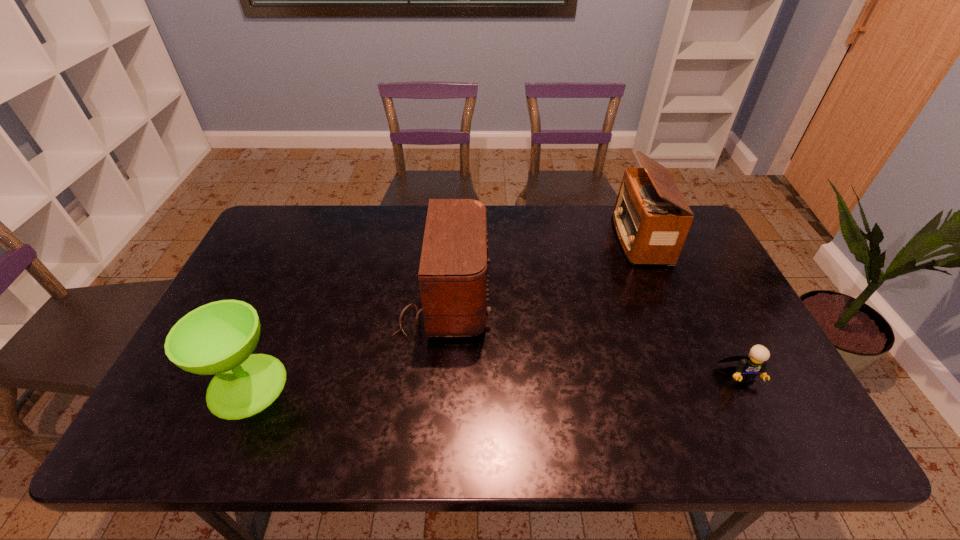
Where is `free region located 0.120m on the front-facing side of the shortest object`? Image resolution: width=960 pixels, height=540 pixels. free region located 0.120m on the front-facing side of the shortest object is located at coordinates (772, 436).

Where is `object positioned at the far edge`? The width and height of the screenshot is (960, 540). object positioned at the far edge is located at coordinates (652, 219).

Find the location of a particular element. This screenshot has width=960, height=540. object located at the near edge is located at coordinates (218, 338).

This screenshot has height=540, width=960. Identify the location of object present at the left edge. (218, 338).

Locate an element on the screen. This screenshot has width=960, height=540. radio receiver located in the right edge section of the desktop is located at coordinates (652, 219).

Where is `Lego at the right edge`? This screenshot has height=540, width=960. Lego at the right edge is located at coordinates (749, 366).

In order to click on object positioned at the near left corner in this screenshot , I will do `click(218, 338)`.

I want to click on object that is at the far right corner, so click(x=652, y=219).

Identify the location of vacant region at the far edge of the desktop. (593, 241).

At what (x,y) coordinates should I click in order to perform the action: click on free space at the near edge of the desktop. Please return your answer as a coordinate pair (x, y). Looking at the image, I should click on [589, 418].